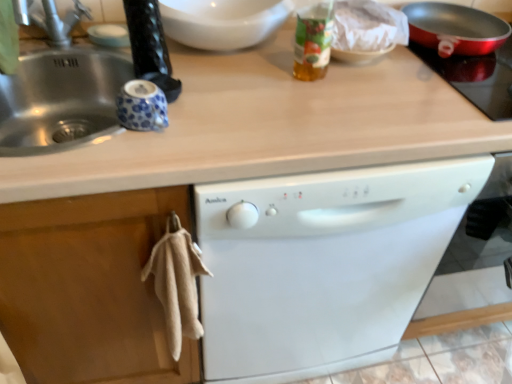
Question: Considering the relative sizes of translucent plastic bottle at upper center and metallic red pan at upper right in the image provided, is translucent plastic bottle at upper center thinner than metallic red pan at upper right?

Choices:
 (A) no
 (B) yes

Answer: (B)

Question: Is metallic red pan at upper right a part of translucent plastic bottle at upper center?

Choices:
 (A) no
 (B) yes

Answer: (A)

Question: Is translucent plastic bottle at upper center to the left of metallic red pan at upper right from the viewer's perspective?

Choices:
 (A) no
 (B) yes

Answer: (B)

Question: Considering the relative positions of translucent plastic bottle at upper center and metallic red pan at upper right in the image provided, is translucent plastic bottle at upper center to the right of metallic red pan at upper right from the viewer's perspective?

Choices:
 (A) no
 (B) yes

Answer: (A)

Question: Is translucent plastic bottle at upper center facing towards metallic red pan at upper right?

Choices:
 (A) yes
 (B) no

Answer: (B)

Question: In terms of width, does metallic red pan at upper right look wider or thinner when compared to white glossy bowl at upper center?

Choices:
 (A) thin
 (B) wide

Answer: (B)

Question: Is point (424, 59) closer or farther from the camera than point (186, 3)?

Choices:
 (A) closer
 (B) farther

Answer: (B)

Question: Would you say metallic red pan at upper right is inside or outside white glossy bowl at upper center?

Choices:
 (A) inside
 (B) outside

Answer: (B)

Question: Visually, is metallic red pan at upper right positioned to the left or to the right of white glossy bowl at upper center?

Choices:
 (A) right
 (B) left

Answer: (A)

Question: From the image's perspective, is white glossy dishwasher at center above or below white glossy bowl at upper center?

Choices:
 (A) above
 (B) below

Answer: (B)

Question: Considering the positions of white glossy dishwasher at center and white glossy bowl at upper center in the image, is white glossy dishwasher at center bigger or smaller than white glossy bowl at upper center?

Choices:
 (A) big
 (B) small

Answer: (A)

Question: From a real-world perspective, is white glossy dishwasher at center above or below white glossy bowl at upper center?

Choices:
 (A) above
 (B) below

Answer: (B)

Question: Which is correct: white glossy dishwasher at center is inside white glossy bowl at upper center, or outside of it?

Choices:
 (A) outside
 (B) inside

Answer: (A)

Question: Considering the positions of white glossy bowl at upper center and silver metallic faucet at upper left in the image, is white glossy bowl at upper center taller or shorter than silver metallic faucet at upper left?

Choices:
 (A) short
 (B) tall

Answer: (A)

Question: Is point (212, 11) closer or farther from the camera than point (23, 21)?

Choices:
 (A) closer
 (B) farther

Answer: (A)